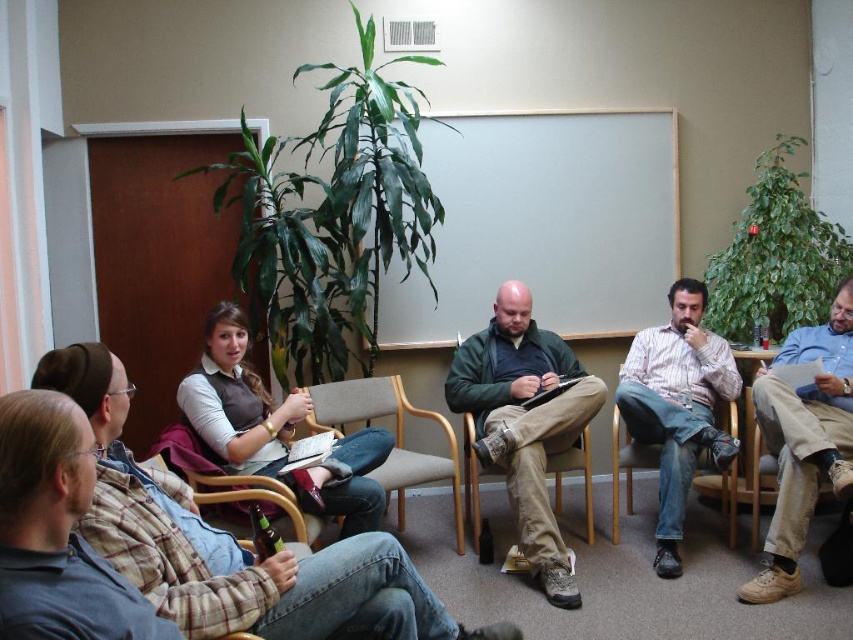
Who is positioned more to the right, khaki fabric chair at lower right or tan fabric chair at center?

Positioned to the right is khaki fabric chair at lower right.

Is khaki fabric chair at lower right in front of tan fabric chair at center?

That is True.

What do you see at coordinates (790, 456) in the screenshot?
I see `khaki fabric chair at lower right` at bounding box center [790, 456].

Locate an element on the screen. khaki fabric chair at lower right is located at coordinates (790, 456).

In the scene shown: Who is positioned more to the right, tan canvas pants at center or white striped shirt at center?

From the viewer's perspective, tan canvas pants at center appears more on the right side.

Between point (753, 403) and point (665, 378), which one is positioned behind?

The point (665, 378) is behind.

Find the location of a particular element. This screenshot has width=853, height=640. tan canvas pants at center is located at coordinates (804, 442).

In the scene shown: Who is taller, green matte jacket at center or tan fabric chair at center?

Standing taller between the two is green matte jacket at center.

I want to click on green matte jacket at center, so click(x=525, y=420).

This screenshot has width=853, height=640. What do you see at coordinates (525, 420) in the screenshot?
I see `green matte jacket at center` at bounding box center [525, 420].

Locate an element on the screen. green matte jacket at center is located at coordinates (525, 420).